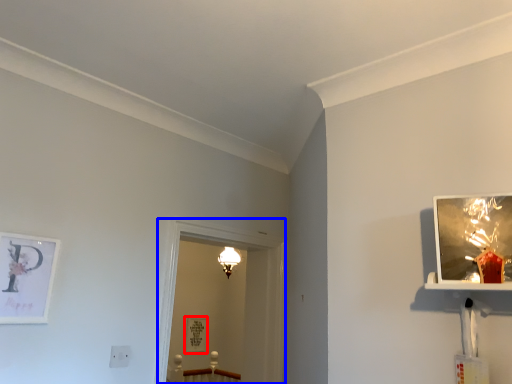
Question: Among these objects, which one is nearest to the camera, picture frame (highlighted by a red box) or glass door (highlighted by a blue box)?

Choices:
 (A) picture frame
 (B) glass door

Answer: (B)